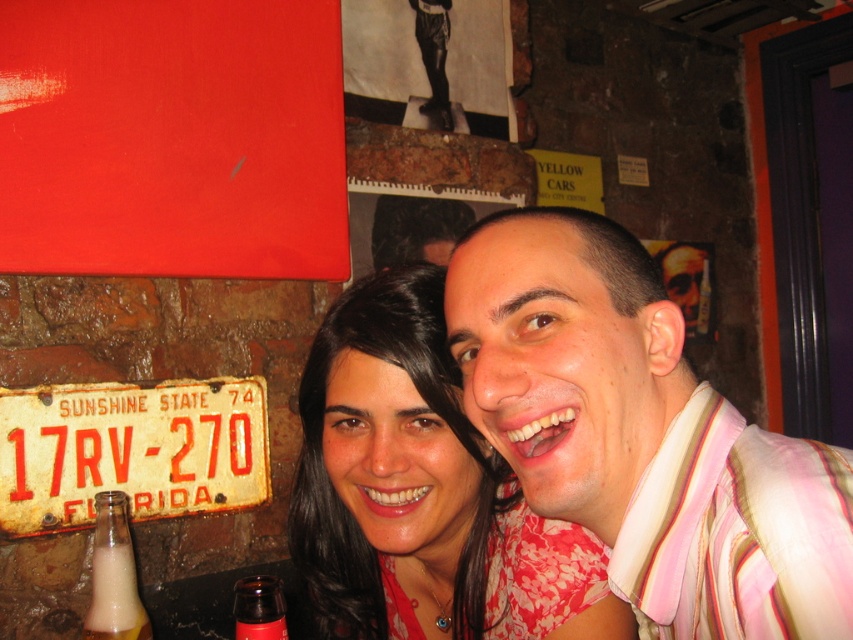
Question: Which of the following is the farthest from the observer?

Choices:
 (A) translucent glass bottle at lower left
 (B) matte red hair at center
 (C) brown glass bottle at lower left
 (D) pink striped shirt at center

Answer: (A)

Question: Does rusty metal license plate at lower left have a smaller size compared to brown glass bottle at lower left?

Choices:
 (A) no
 (B) yes

Answer: (A)

Question: Which point appears farthest from the camera in this image?

Choices:
 (A) (749, 616)
 (B) (93, 480)
 (C) (141, 630)

Answer: (B)

Question: Where is pink striped shirt at center located in relation to brown glass bottle at lower left in the image?

Choices:
 (A) right
 (B) left

Answer: (A)

Question: Which point is farther to the camera?

Choices:
 (A) (584, 385)
 (B) (281, 600)
 (C) (239, 426)

Answer: (C)

Question: Is rusty metal license plate at lower left smaller than translucent glass bottle at lower left?

Choices:
 (A) no
 (B) yes

Answer: (A)